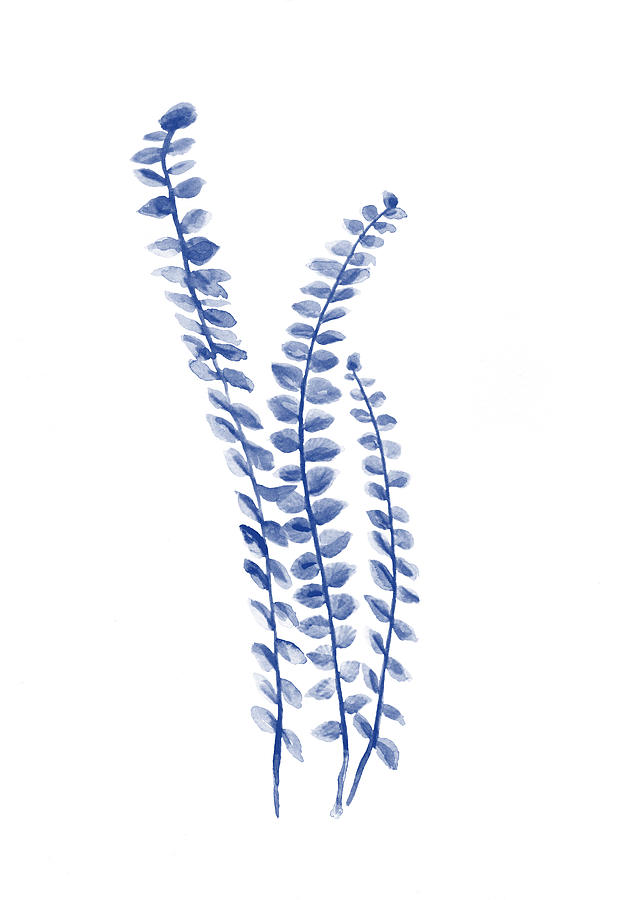
You are a GUI agent. You are given a task and a screenshot of the screen. Output one action in this format:
    pyautogui.click(x=<x>, y=<y>)
    Task: Click on the white background below painting
    Image resolution: width=621 pixels, height=900 pixels.
    Given the screenshot: What is the action you would take?
    pyautogui.click(x=310, y=847)